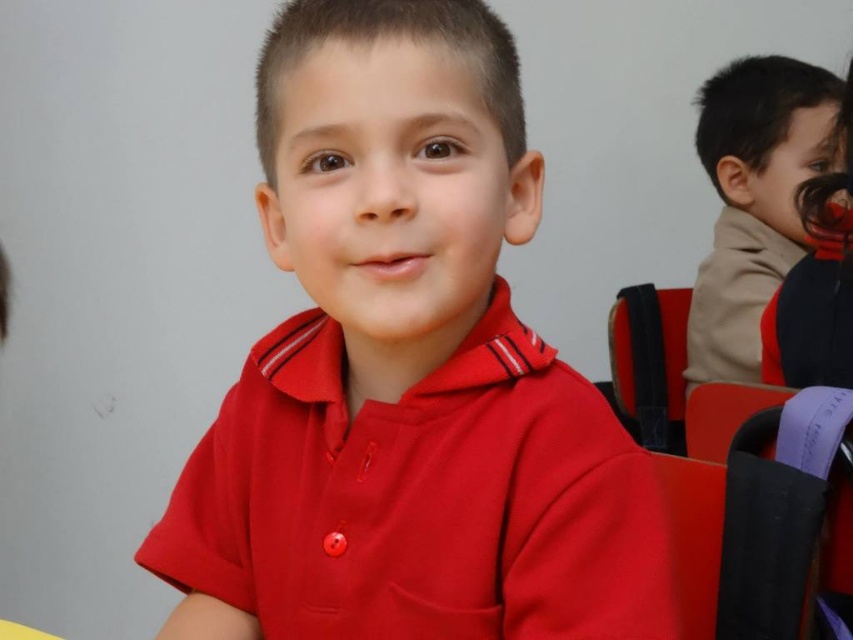
You are a teacher in a classroom. You need to place a 8 inch ruler between the brown fuzzy sweater at upper right and the black fabric chair at right. Is there enough space to fit the ruler between them?

The brown fuzzy sweater at upper right is 7.96 inches from the black fabric chair at right. Since the ruler is 8 inches long, there isn not enough space to fit it between them.

You are standing in a classroom and see a young boy in a red polo shirt. There is a point marked at coordinates (753,202). What object is located at that point?

The point at coordinates (753,202) marks the brown fuzzy sweater at upper right.

You are an AI analyzing the image. The scene shows a young boy in a classroom. Where is the matte red shirt at center located in terms of coordinates?

The matte red shirt at center is located at the 2D coordinates point (405, 372).